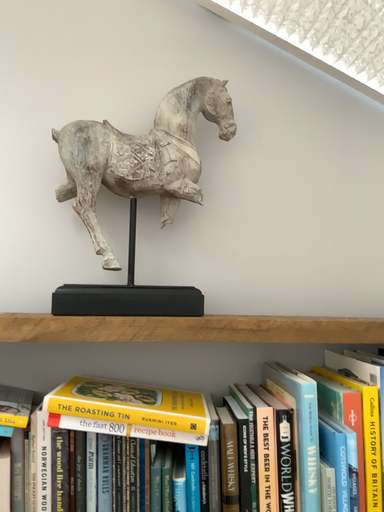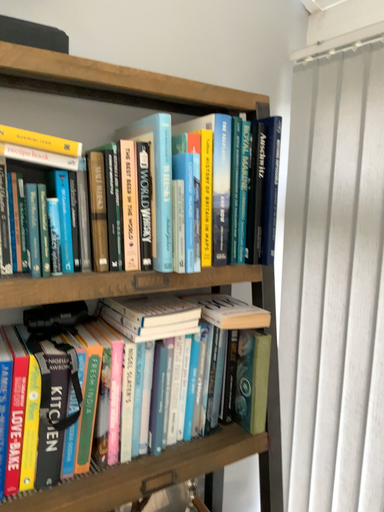
Question: Which way did the camera rotate in the video?

Choices:
 (A) rotated right
 (B) rotated left

Answer: (A)